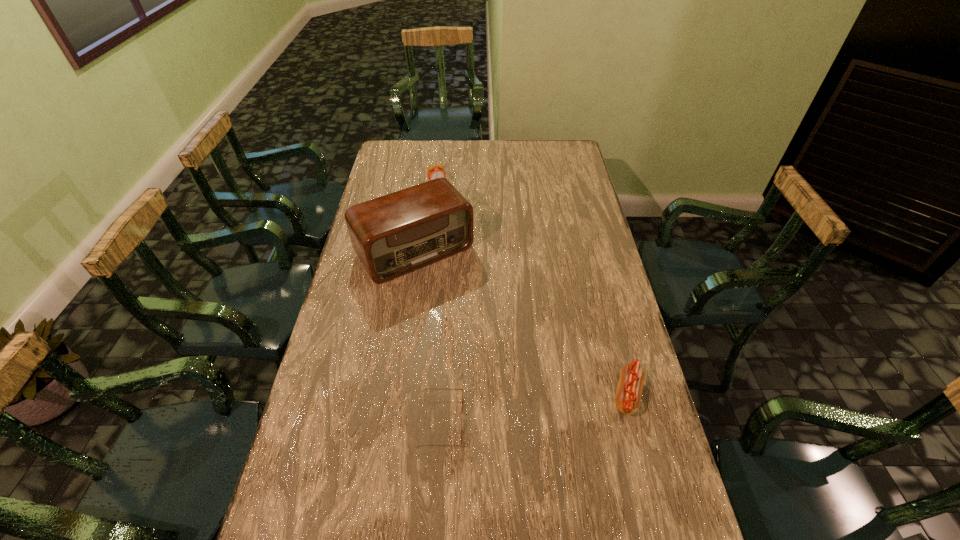
This screenshot has height=540, width=960. Find the location of `vacant area situated on the front panel of the tallest object`. vacant area situated on the front panel of the tallest object is located at coordinates (491, 347).

Find the location of a particular element. free space located on the front panel of the tallest object is located at coordinates (503, 363).

Locate an element on the screen. This screenshot has height=540, width=960. free space located 0.390m on the face of the farthest object is located at coordinates (467, 246).

At what (x,y) coordinates should I click in order to perform the action: click on vacant space located on the face of the farthest object. Please return your answer as a coordinate pair (x, y). Looking at the image, I should click on (466, 242).

Find the location of a particular element. Image resolution: width=960 pixels, height=540 pixels. vacant space located 0.210m on the face of the farthest object is located at coordinates (453, 217).

This screenshot has width=960, height=540. Identify the location of object that is at the left edge. (400, 232).

Locate an element on the screen. The image size is (960, 540). object present at the right edge is located at coordinates pos(628,395).

Where is `free region at the far edge of the desktop`? Image resolution: width=960 pixels, height=540 pixels. free region at the far edge of the desktop is located at coordinates (475, 140).

In the image, there is a desktop. Identify the location of vacant area at the left edge. The height and width of the screenshot is (540, 960). 388,184.

The image size is (960, 540). What are the coordinates of `vacant space at the right edge of the desktop` in the screenshot? It's located at (584, 278).